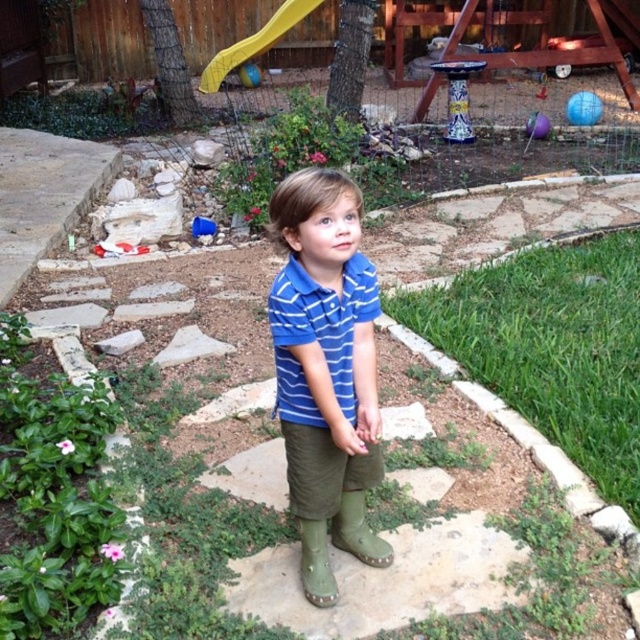
You are trying to decide whether to let the child walk on the green grass at lower right or the green rubber boot at center. Which surface is wider?

The green grass at lower right might be wider than green rubber boot at center.

The child is wearing two blue striped items. Which one is taller, the blue striped shirt at center or the blue striped polo shirt at center?

The blue striped shirt at center is much taller than the blue striped polo shirt at center.

The child is wearing two blue items. Which one is the blue striped shirt at center located below the blue striped polo shirt at center?

The blue striped shirt at center is located below the blue striped polo shirt at center.